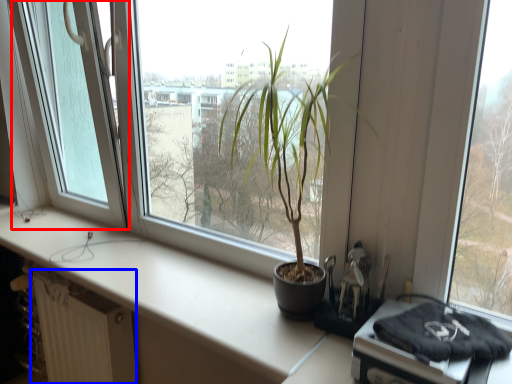
Question: Which of the following is the closest to the observer, glass door (highlighted by a red box) or radiator (highlighted by a blue box)?

Choices:
 (A) glass door
 (B) radiator

Answer: (A)